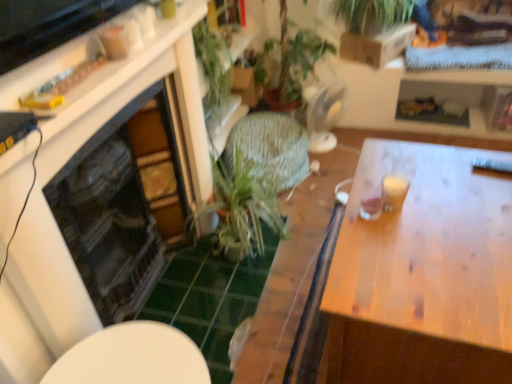
The width and height of the screenshot is (512, 384). What do you see at coordinates (241, 206) in the screenshot? I see `green leafy plant at center` at bounding box center [241, 206].

Locate an element on the screen. white glossy table at lower center is located at coordinates (132, 357).

Is wooden table at right looking in the opposite direction of green leafy plant at center?

No, green leafy plant at center is not at the back of wooden table at right.

Looking at this image, from a real-world perspective, is wooden table at right above or below green leafy plant at center?

From a real-world perspective, wooden table at right is physically above green leafy plant at center.

Is white glossy table at lower center bigger or smaller than wooden table at right?

white glossy table at lower center is smaller than wooden table at right.

Who is shorter, white glossy table at lower center or wooden table at right?

With less height is white glossy table at lower center.

In the scene shown: From a real-world perspective, is white glossy table at lower center positioned under wooden table at right based on gravity?

Indeed, from a real-world perspective, white glossy table at lower center is positioned beneath wooden table at right.

From the picture: Considering the positions of objects white glossy table at lower center and wooden table at right in the image provided, who is more to the right, white glossy table at lower center or wooden table at right?

wooden table at right.

Considering the positions of objects white glossy table at lower center and green leafy plant at center in the image provided, who is more to the left, white glossy table at lower center or green leafy plant at center?

Positioned to the left is white glossy table at lower center.

Considering their positions, is white glossy table at lower center located in front of or behind green leafy plant at center?

Clearly, white glossy table at lower center is in front of green leafy plant at center.

Is white glossy table at lower center far from green leafy plant at center?

They are positioned close to each other.

From the image's perspective, which is below, white glossy table at lower center or green leafy plant at center?

white glossy table at lower center appears lower in the image.

Does wooden table at right turn towards green leafy plant at upper center?

Yes, wooden table at right is facing green leafy plant at upper center.

Is point (424, 189) positioned after point (355, 29)?

No, it is not.

Which is behind, wooden table at right or green leafy plant at upper center?

green leafy plant at upper center is further away from the camera.

Considering the sizes of wooden table at right and green leafy plant at upper center in the image, is wooden table at right taller or shorter than green leafy plant at upper center?

Considering their sizes, wooden table at right has more height than green leafy plant at upper center.

Looking at their sizes, would you say green leafy plant at center is wider or thinner than white glossy table at lower center?

Clearly, green leafy plant at center has more width compared to white glossy table at lower center.

Considering the positions of objects green leafy plant at center and white glossy table at lower center in the image provided, who is more to the left, green leafy plant at center or white glossy table at lower center?

Positioned to the left is white glossy table at lower center.

From the image's perspective, is green leafy plant at upper center above white glossy table at lower center?

Indeed, from the image's perspective, green leafy plant at upper center is shown above white glossy table at lower center.

From a real-world perspective, is green leafy plant at upper center on white glossy table at lower center?

Yes, from a real-world perspective, green leafy plant at upper center is over white glossy table at lower center

Considering the positions of points (379, 16) and (68, 373), is point (379, 16) farther from camera compared to point (68, 373)?

That is True.

Which is correct: green leafy plant at upper center is inside white glossy table at lower center, or outside of it?

green leafy plant at upper center cannot be found inside white glossy table at lower center.

Is green leafy plant at upper center facing towards wooden table at right?

Yes.

In the image, there is a green leafy plant at upper center. Identify the location of table below it (from a real-world perspective). This screenshot has height=384, width=512. (424, 275).

Does point (362, 34) come behind point (447, 169)?

Yes, point (362, 34) is behind point (447, 169).

From the image's perspective, between green leafy plant at upper center and wooden table at right, which one is located above?

green leafy plant at upper center is shown above in the image.

Locate an element on the screen. This screenshot has height=384, width=512. table lying on the right of green leafy plant at center is located at coordinates (424, 275).

Locate an element on the screen. table that appears above the white glossy table at lower center (from the image's perspective) is located at coordinates (424, 275).

Looking at the image, which one is located further to green leafy plant at center, wooden table at right or green leafy plant at upper center?

green leafy plant at upper center.

When comparing their distances from green leafy plant at upper center, does white glossy table at lower center or wooden table at right seem closer?

wooden table at right is closer to green leafy plant at upper center.

Looking at the image, which one is located further to wooden table at right, white glossy table at lower center or green leafy plant at upper center?

A: green leafy plant at upper center is further to wooden table at right.

Looking at the image, which one is located further to wooden table at right, white glossy table at lower center or green leafy plant at center?

green leafy plant at center is positioned further to the anchor wooden table at right.

Consider the image. Based on their spatial positions, is green leafy plant at upper center or white glossy table at lower center closer to wooden table at right?

The object closer to wooden table at right is white glossy table at lower center.

Considering their positions, is wooden table at right positioned further to white glossy table at lower center than green leafy plant at center?

The object further to white glossy table at lower center is green leafy plant at center.

From the picture: Considering their positions, is wooden table at right positioned closer to green leafy plant at center than white glossy table at lower center?

The object closer to green leafy plant at center is wooden table at right.

From the image, which object appears to be farther from green leafy plant at upper center, wooden table at right or green leafy plant at center?

wooden table at right.

The image size is (512, 384). In order to click on houseplant between white glossy table at lower center and wooden table at right in the horizontal direction in this screenshot , I will do `click(241, 206)`.

Where is `houseplant that lies between green leafy plant at upper center and white glossy table at lower center from top to bottom`? The image size is (512, 384). houseplant that lies between green leafy plant at upper center and white glossy table at lower center from top to bottom is located at coordinates (241, 206).

Find the location of `houseplant between green leafy plant at upper center and wooden table at right in the up-down direction`. houseplant between green leafy plant at upper center and wooden table at right in the up-down direction is located at coordinates (241, 206).

This screenshot has height=384, width=512. Identify the location of table between green leafy plant at upper center and white glossy table at lower center vertically. (424, 275).